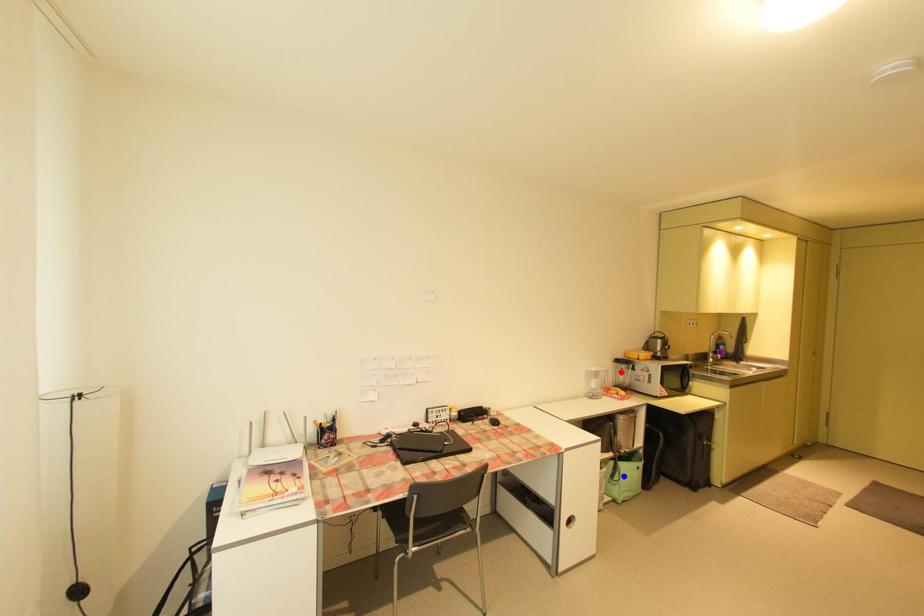
Order these from farthest to nearest:
red point, purple point, blue point

purple point, red point, blue point